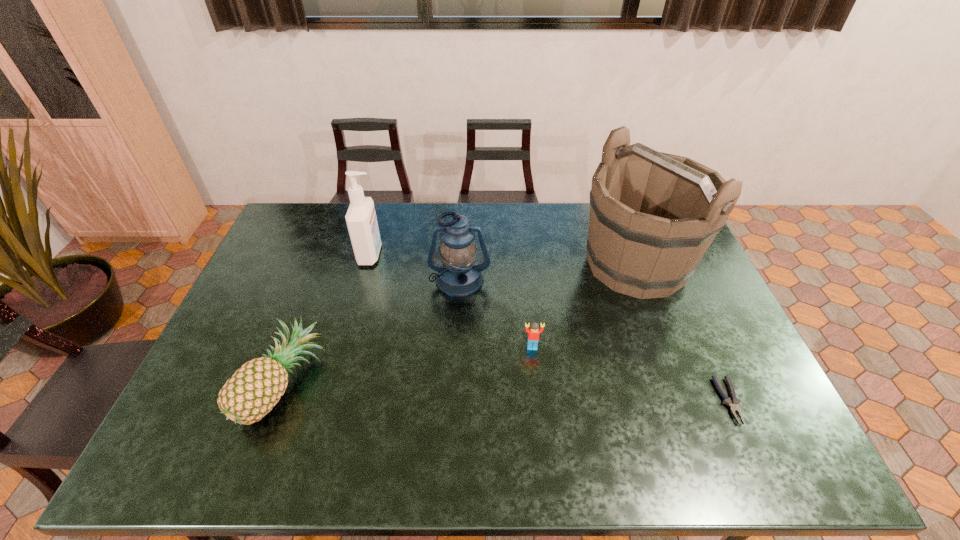
Locate an element on the screen. Image resolution: width=960 pixels, height=540 pixels. object that is at the near left corner is located at coordinates (255, 388).

Locate an element on the screen. The height and width of the screenshot is (540, 960). object present at the far right corner is located at coordinates (653, 215).

This screenshot has width=960, height=540. I want to click on vacant position at the far edge of the desktop, so click(484, 236).

At what (x,y) coordinates should I click in order to perform the action: click on vacant space at the near edge. Please return your answer as a coordinate pair (x, y). Looking at the image, I should click on (251, 442).

The width and height of the screenshot is (960, 540). In the image, there is a desktop. Identify the location of free region at the left edge. (305, 247).

The height and width of the screenshot is (540, 960). I want to click on vacant space at the right edge of the desktop, so click(x=737, y=347).

Locate an element on the screen. This screenshot has height=540, width=960. blank region between the cleansing agent and the lantern is located at coordinates (415, 267).

I want to click on unoccupied area between the fifth shortest object and the fourth shortest object, so click(415, 267).

Find the location of a particular element. free space between the third shortest object and the tallest object is located at coordinates (461, 324).

The image size is (960, 540). In order to click on free space between the third object from left to right and the shortest object in this screenshot , I will do `click(594, 340)`.